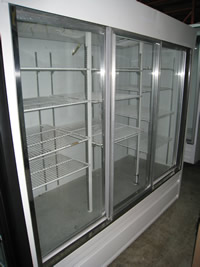
The image size is (200, 267). I want to click on large industrial refrigerator, so click(118, 102).